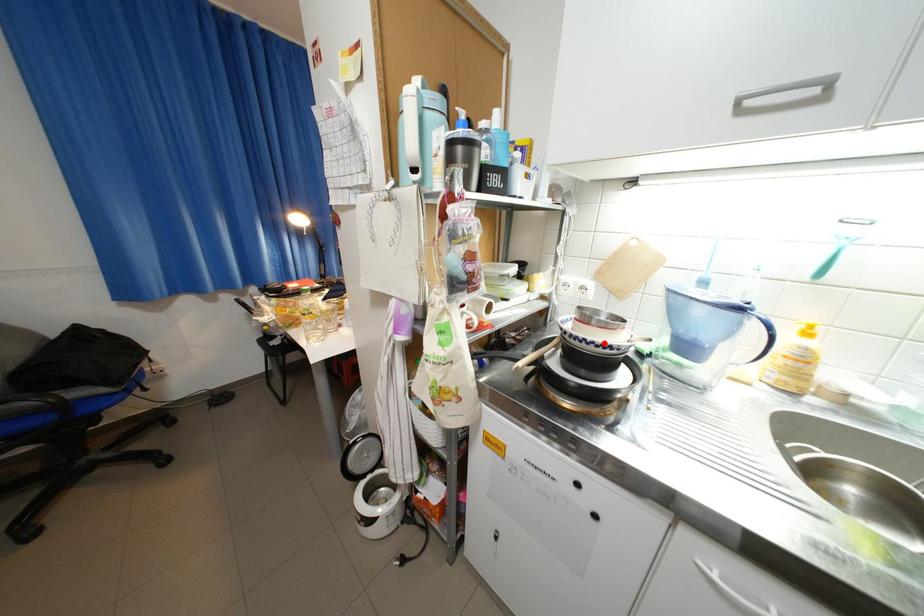
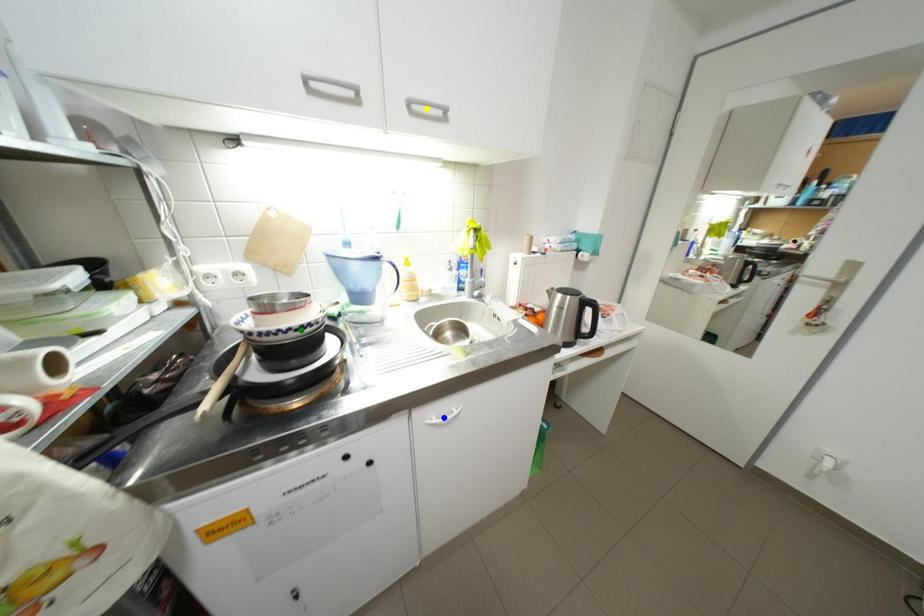
Question: I am providing you with two images of the same scene from different viewpoints. A red point is marked on the first image. You are given multiple points on the second image. In image 2, which mark is for the same physical point as the one in image 1?

Choices:
 (A) yellow point
 (B) blue point
 (C) green point

Answer: (C)